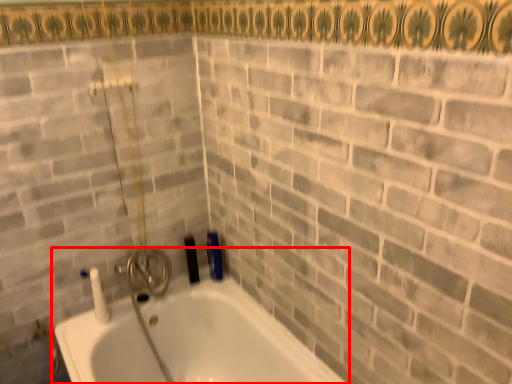
Question: From the image's perspective, where is bathtub (annotated by the red box) located relative to brick?

Choices:
 (A) above
 (B) below

Answer: (B)